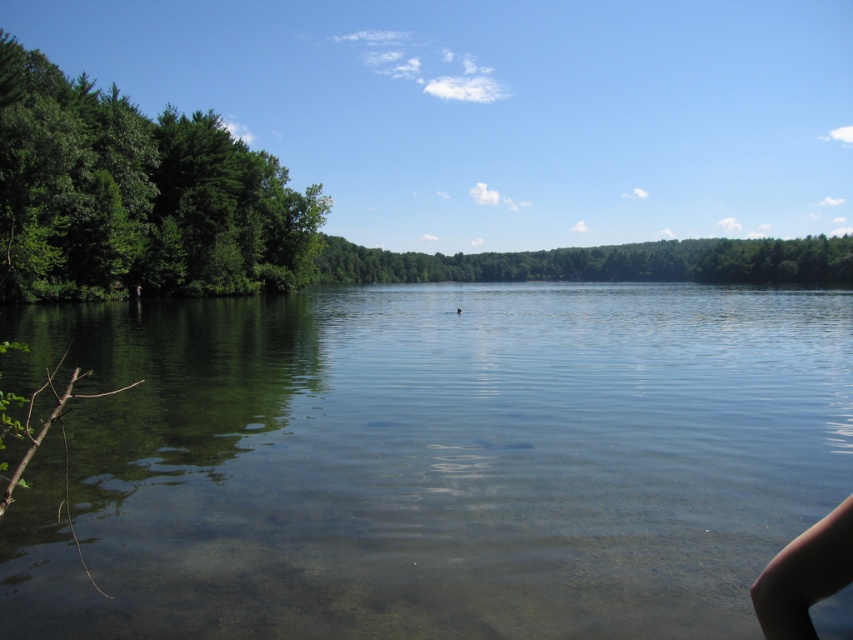
Does green leafy trees at center appear over skinny tan leg at lower right?

Correct, green leafy trees at center is located above skinny tan leg at lower right.

Which is in front, point (531, 276) or point (809, 634)?

Positioned in front is point (809, 634).

Image resolution: width=853 pixels, height=640 pixels. I want to click on green leafy trees at center, so click(602, 262).

Does clear water at center have a greater width compared to green leafy trees at left?

Indeed, clear water at center has a greater width compared to green leafy trees at left.

Who is taller, clear water at center or green leafy trees at left?

green leafy trees at left

Does point (648, 337) come behind point (4, 77)?

That is False.

Where is `clear water at center`? clear water at center is located at coordinates (428, 460).

Can you confirm if green leafy trees at left is smaller than green leafy trees at center?

Correct, green leafy trees at left occupies less space than green leafy trees at center.

Does point (263, 253) come behind point (373, 264)?

No, it is in front of (373, 264).

Image resolution: width=853 pixels, height=640 pixels. Find the location of `green leafy trees at left`. green leafy trees at left is located at coordinates (136, 196).